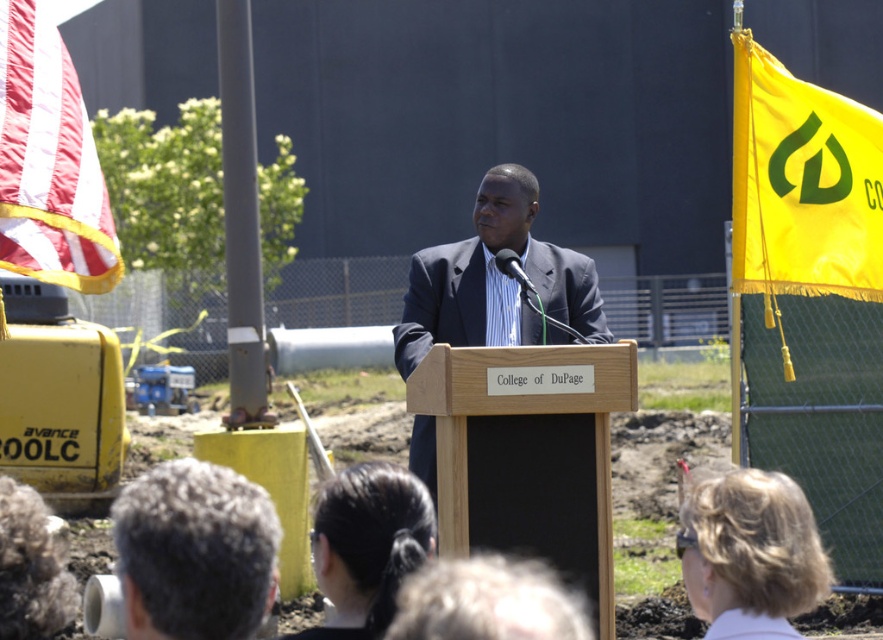
You are a photographer at the event and want to capture a photo of the yellow fabric flag at upper right. The camera you are using has a zoom lens that can focus on objects within a 0.3 unit radius from the center of the viewfinder. If you center your viewfinder at coordinates point A, which is at position point A is at point A is at point A is at point A is at point A is at point A is at point A is at point A is at point A is at point A is at point A is at point A is at point A is at point A is at point A.

The yellow fabric flag at upper right is located at point (802, 182). Since the camera can focus on objects within a 0.3 unit radius from the center, if point A is within 0.3 units from (802, 182), then the flag will be in focus. However, without knowing the exact coordinates of point A, it is impossible to determine if the flag will be in focus.